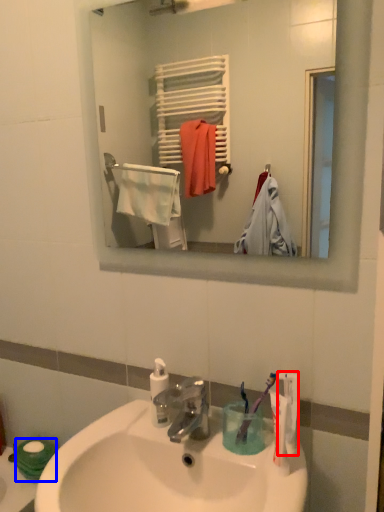
Question: Among these objects, which one is nearest to the camera, toothpaste (highlighted by a red box) or toilet paper (highlighted by a blue box)?

Choices:
 (A) toothpaste
 (B) toilet paper

Answer: (A)